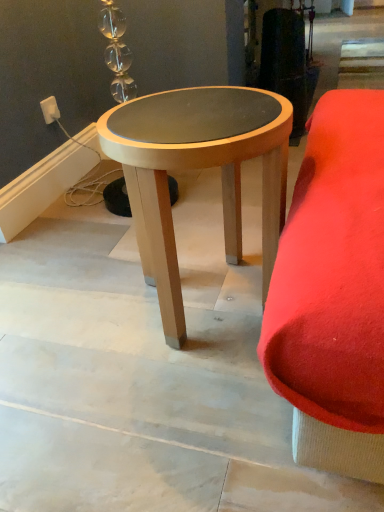
Identify the location of free space in front of light wood/woodenobject at center. pos(179,423).